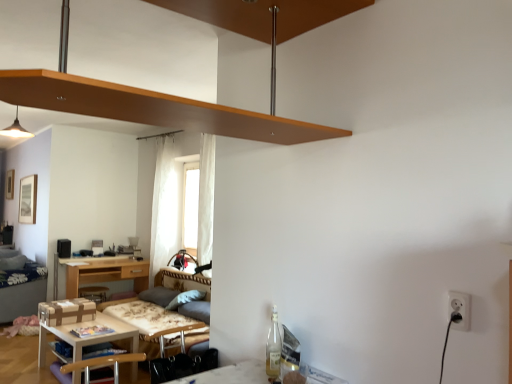
Question: In terms of size, does white sheer curtain at center appear bigger or smaller than wooden table at lower left?

Choices:
 (A) small
 (B) big

Answer: (B)

Question: Relative to wooden table at lower left, is white sheer curtain at center in front or behind?

Choices:
 (A) behind
 (B) front

Answer: (A)

Question: Estimate the real-world distances between objects in this image. Which object is farther from the light brown wooden desk at center?

Choices:
 (A) white sheer curtain at center
 (B) soft gray fabric pillow at lower center
 (C) white plastic electric outlet at lower right
 (D) velvet grey couch at lower left
 (E) brown wooden shelf at upper center

Answer: (C)

Question: Which of these objects is positioned closest to the brown wooden shelf at upper center?

Choices:
 (A) white plastic electric outlet at lower right
 (B) light brown wooden desk at center
 (C) dark blue fabric bed at left
 (D) wooden table at lower left
 (E) matte white pendant light at upper left

Answer: (A)